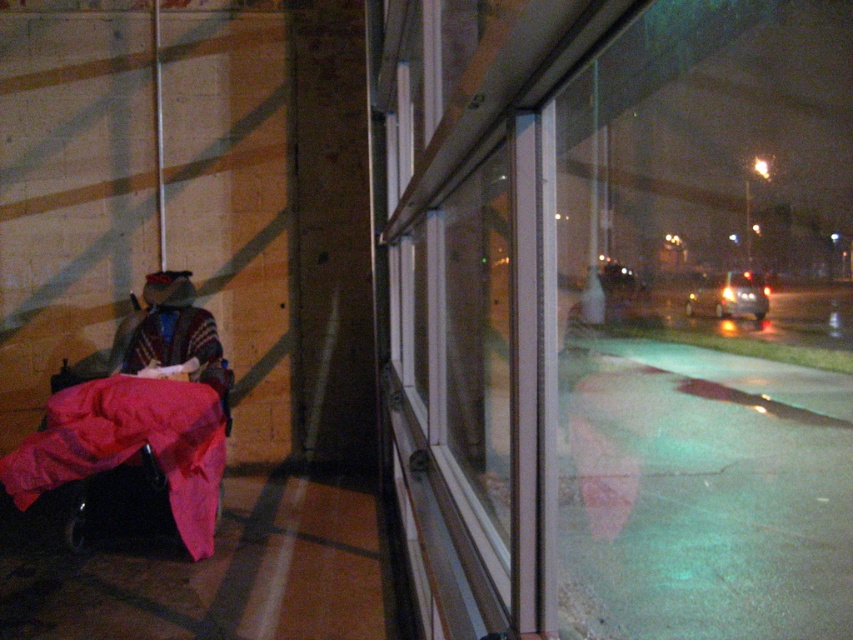
Question: Which of the following is the closest to the observer?

Choices:
 (A) (572, 186)
 (B) (67, 419)

Answer: (B)

Question: Considering the relative positions of transparent glass window at center and velvet red blanket at lower left in the image provided, where is transparent glass window at center located with respect to velvet red blanket at lower left?

Choices:
 (A) right
 (B) left

Answer: (A)

Question: Does transparent glass window at center have a lesser width compared to velvet red blanket at lower left?

Choices:
 (A) yes
 (B) no

Answer: (B)

Question: Is the position of transparent glass window at center more distant than that of velvet red blanket at lower left?

Choices:
 (A) no
 (B) yes

Answer: (A)